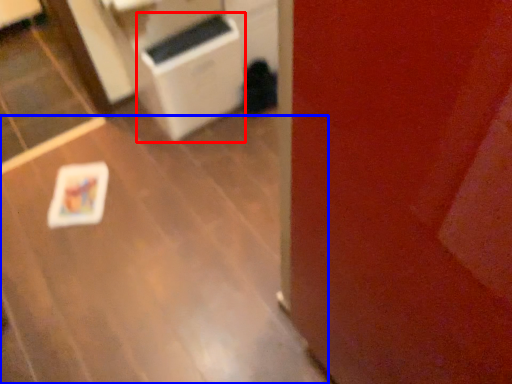
Question: Which of the following is the farthest to the observer, appliance (highlighted by a red box) or table (highlighted by a blue box)?

Choices:
 (A) appliance
 (B) table

Answer: (A)